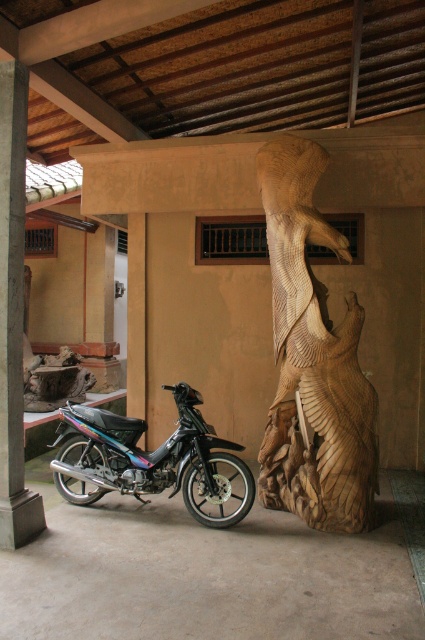
Question: Among these points, which one is nearest to the camera?

Choices:
 (A) (105, 472)
 (B) (305, 268)

Answer: (B)

Question: Among these objects, which one is farthest from the camera?

Choices:
 (A) metallic/matte black motorcycle at lower left
 (B) wooden carving of bird at right

Answer: (A)

Question: Can you confirm if wooden carving of bird at right is positioned to the right of metallic/matte black motorcycle at lower left?

Choices:
 (A) no
 (B) yes

Answer: (B)

Question: Among these objects, which one is nearest to the camera?

Choices:
 (A) metallic/matte black motorcycle at lower left
 (B) wooden carving of bird at right

Answer: (B)

Question: Does wooden carving of bird at right come behind metallic/matte black motorcycle at lower left?

Choices:
 (A) no
 (B) yes

Answer: (A)

Question: Considering the relative positions of wooden carving of bird at right and metallic/matte black motorcycle at lower left in the image provided, where is wooden carving of bird at right located with respect to metallic/matte black motorcycle at lower left?

Choices:
 (A) left
 (B) right

Answer: (B)